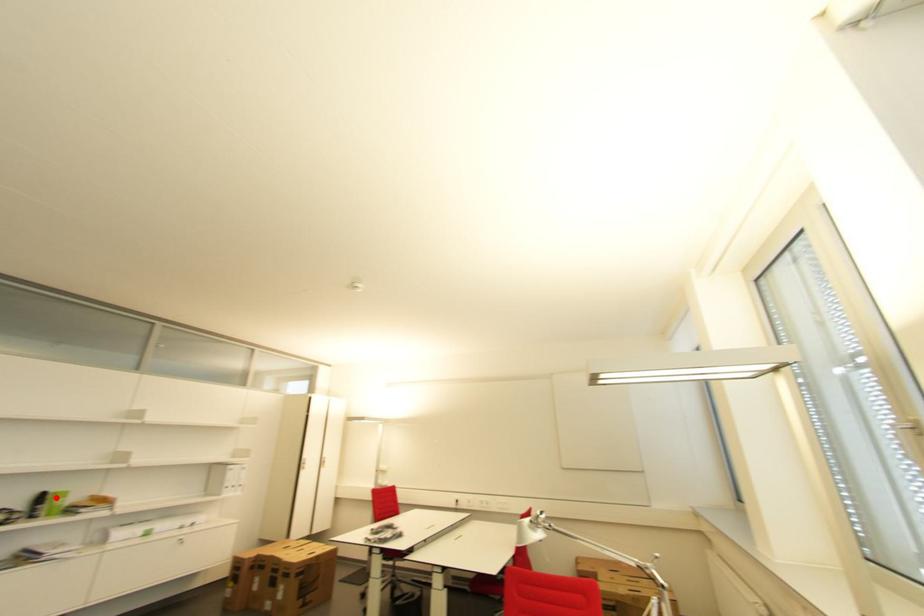
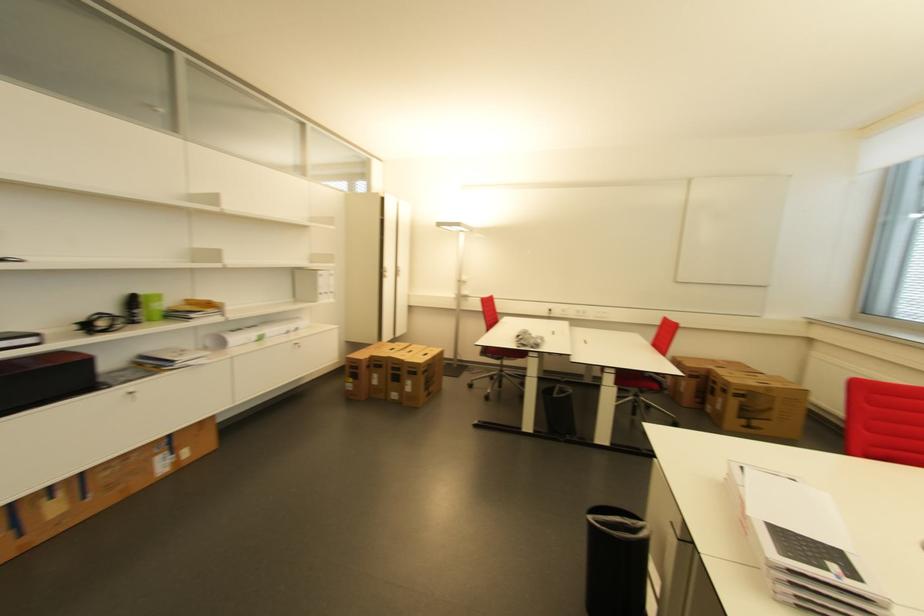
Question: I am providing you with two images of the same scene from different viewpoints. Image1 has a red point marked. In image2, the corresponding 3D location appears at what relative position? Reply with the corresponding letter.

Choices:
 (A) Closer
 (B) Farther

Answer: (B)